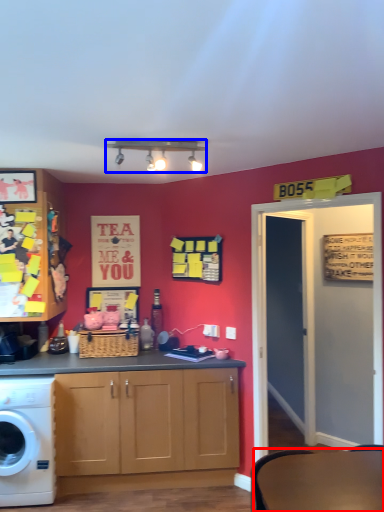
Question: Which of the following is the farthest to the observer, round table (highlighted by a red box) or lamp (highlighted by a blue box)?

Choices:
 (A) round table
 (B) lamp

Answer: (B)